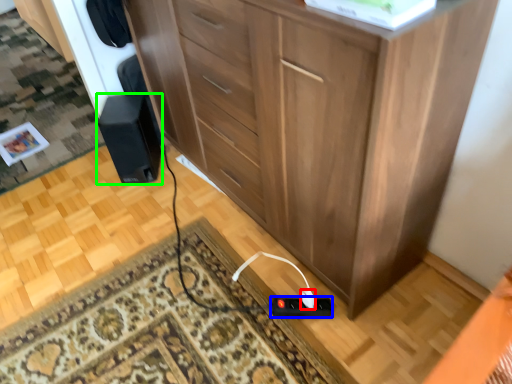
Question: Which is nearer to the plug (highlighted by a red box)? plug (highlighted by a blue box) or speaker (highlighted by a green box).

Choices:
 (A) plug
 (B) speaker

Answer: (A)